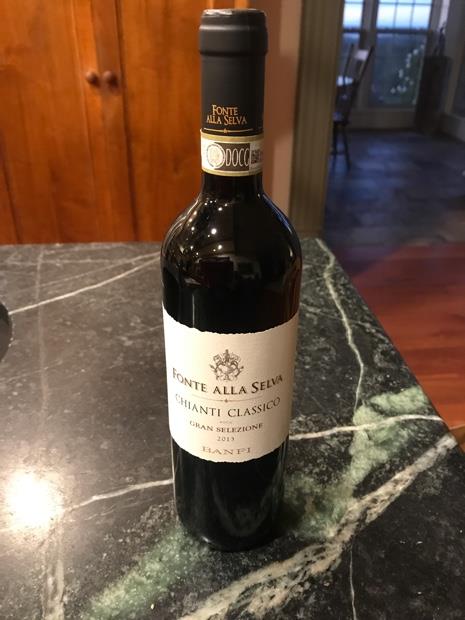
In order to click on windows in this screenshot , I will do `click(402, 66)`, `click(389, 24)`, `click(355, 23)`, `click(347, 38)`.